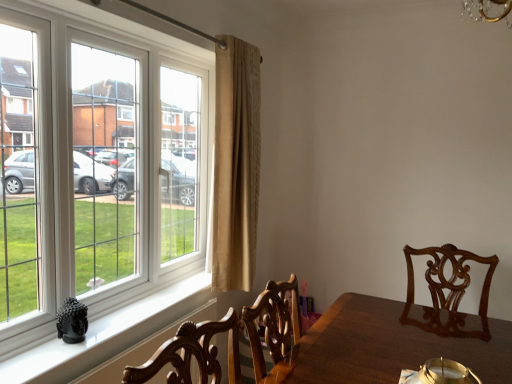
Question: Choose the correct answer: Is black glossy buddha statue at lower left inside beige textured curtain at center or outside it?

Choices:
 (A) outside
 (B) inside

Answer: (A)

Question: Is point (19, 357) positioned closer to the camera than point (223, 238)?

Choices:
 (A) farther
 (B) closer

Answer: (B)

Question: Estimate the real-world distances between objects in this image. Which object is closer to the beige textured curtain at center?

Choices:
 (A) black glossy buddha statue at lower left
 (B) white plastic window at left

Answer: (B)

Question: Which object is positioned farthest from the black glossy buddha statue at lower left?

Choices:
 (A) white plastic window at left
 (B) beige textured curtain at center

Answer: (B)